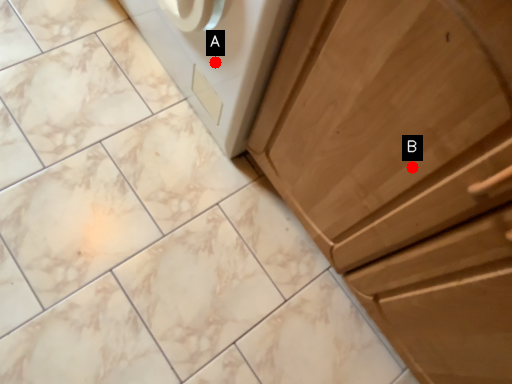
Question: Two points are circled on the image, labeled by A and B beside each circle. Among these points, which one is nearest to the camera?

Choices:
 (A) A is closer
 (B) B is closer

Answer: (B)